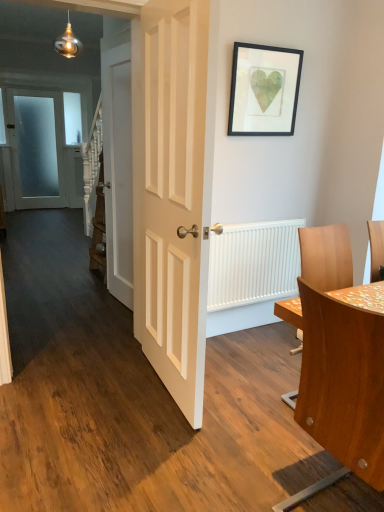
This screenshot has width=384, height=512. I want to click on vacant area to the left of white wooden door at center, acting as the 2th door starting from the left, so click(x=81, y=302).